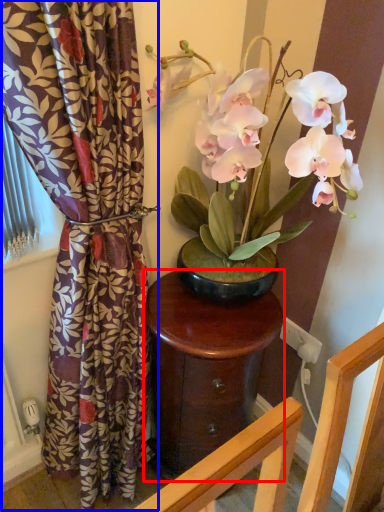
Question: Which point is closer to the camera, table (highlighted by a red box) or curtain (highlighted by a blue box)?

Choices:
 (A) table
 (B) curtain

Answer: (B)